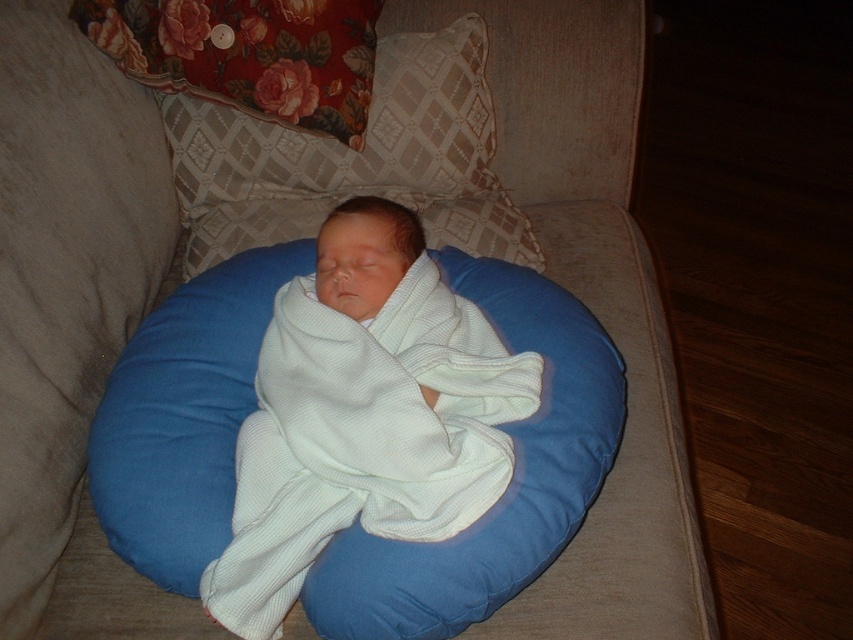
Question: Does white waffle fabric newborn at center come behind white soft pillow at center?

Choices:
 (A) yes
 (B) no

Answer: (B)

Question: Which of the following is the closest to the observer?

Choices:
 (A) white soft pillow at center
 (B) white waffle fabric newborn at center

Answer: (B)

Question: Which object appears closest to the camera in this image?

Choices:
 (A) white soft pillow at center
 (B) white waffle fabric newborn at center

Answer: (B)

Question: Can you confirm if white waffle fabric newborn at center is thinner than white soft pillow at center?

Choices:
 (A) yes
 (B) no

Answer: (A)

Question: Can you confirm if white waffle fabric newborn at center is thinner than white soft pillow at center?

Choices:
 (A) no
 (B) yes

Answer: (B)

Question: Among these points, which one is farthest from the camera?

Choices:
 (A) (415, 44)
 (B) (308, 340)

Answer: (A)